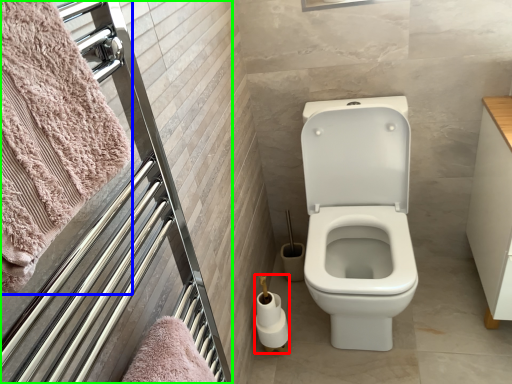
Question: Which object is the farthest from toilet paper (highlighted by a red box)? Choose among these: bath towel (highlighted by a blue box) or screen door (highlighted by a green box).

Choices:
 (A) bath towel
 (B) screen door

Answer: (A)